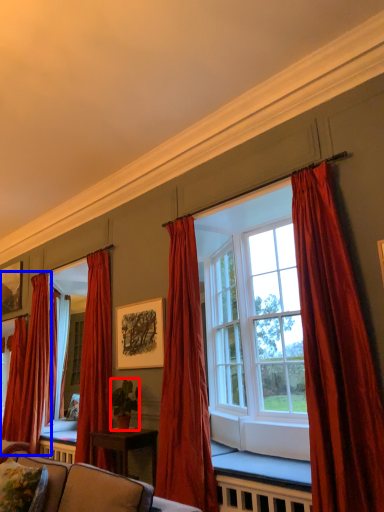
Question: Which object is closer to the camera taking this photo, houseplant (highlighted by a red box) or curtain (highlighted by a blue box)?

Choices:
 (A) houseplant
 (B) curtain

Answer: (A)